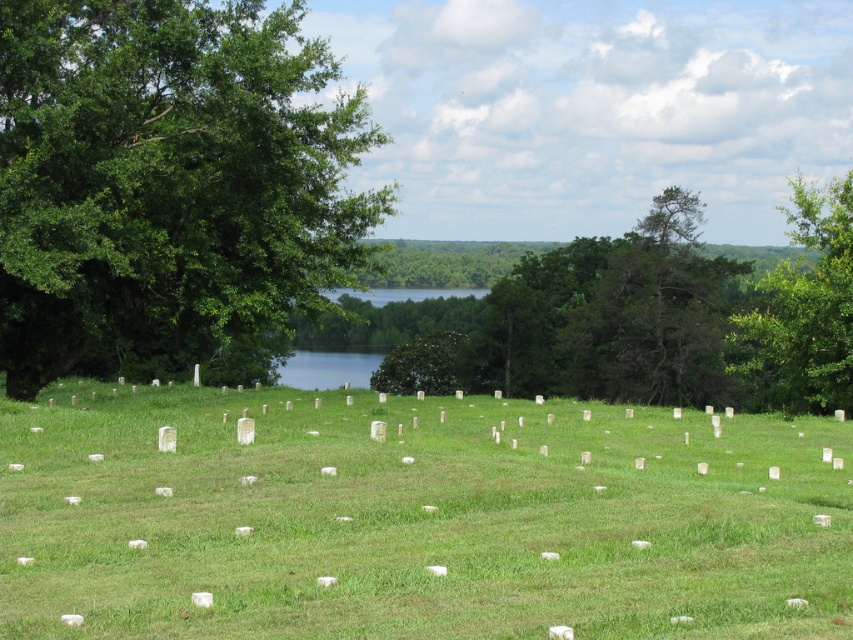
In the scene shown: You are standing at the edge of the grassy field and want to walk towards the green leafy tree at left. Which direction should you walk to reach it while staying on the green grass at center?

You should walk towards the left direction while staying on the green grass at center to reach the green leafy tree at left, as the green grass at center is below the green leafy tree at left.